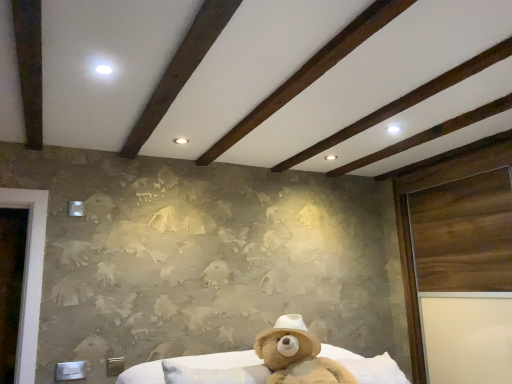
You are a GUI agent. You are given a task and a screenshot of the screen. Output one action in this format:
    pyautogui.click(x=<x>, y=<y>)
    Task: Click on the light brown plush teddy bear at center
    Image resolution: width=512 pixels, height=384 pixels.
    Given the screenshot: What is the action you would take?
    pyautogui.click(x=297, y=355)

The height and width of the screenshot is (384, 512). Describe the element at coordinates (297, 355) in the screenshot. I see `light brown plush teddy bear at center` at that location.

I want to click on light brown plush teddy bear at center, so click(297, 355).